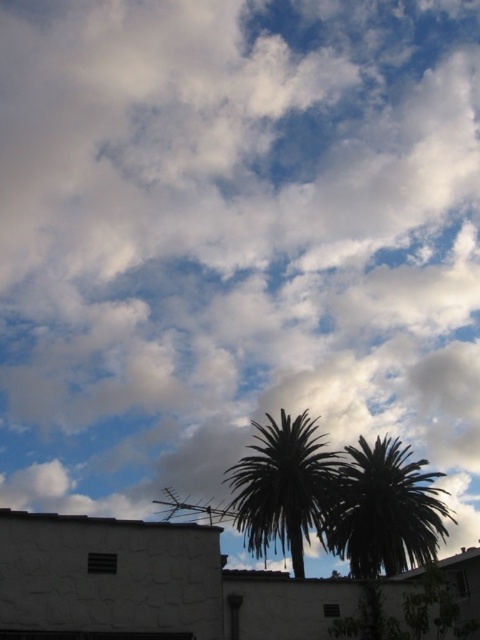
Question: Does green leafy palm tree at center lie in front of green leafy palm at center?

Choices:
 (A) no
 (B) yes

Answer: (B)

Question: Which of the following is the farthest from the observer?

Choices:
 (A) green leafy palm at center
 (B) green leafy palm tree at center

Answer: (A)

Question: Observing the image, what is the correct spatial positioning of green leafy palm tree at center in reference to green leafy palm at center?

Choices:
 (A) below
 (B) above

Answer: (A)

Question: Where is green leafy palm tree at center located in relation to green leafy palm at center in the image?

Choices:
 (A) above
 (B) below

Answer: (B)